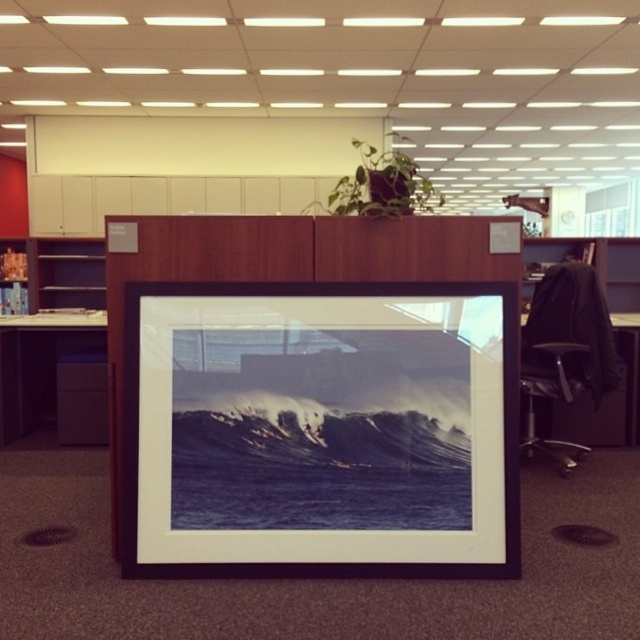
Is black matte picture frame at center positioned at the back of black leather table at right?

No, it is not.

Does black matte picture frame at center lie in front of black leather table at right?

Yes, black matte picture frame at center is closer to the viewer.

The height and width of the screenshot is (640, 640). In order to click on black matte picture frame at center in this screenshot , I will do `click(321, 429)`.

Does matte black table at lower left have a lesser width compared to black leather table at right?

Incorrect, matte black table at lower left's width is not less than black leather table at right's.

Does matte black table at lower left have a greater height compared to black leather table at right?

Correct, matte black table at lower left is much taller as black leather table at right.

What are the coordinates of `matte black table at lower left` in the screenshot? It's located at (38, 364).

Who is more forward, [502,509] or [92,337]?

Point [502,509]

This screenshot has height=640, width=640. Find the location of `black matte picture frame at center`. black matte picture frame at center is located at coordinates (321, 429).